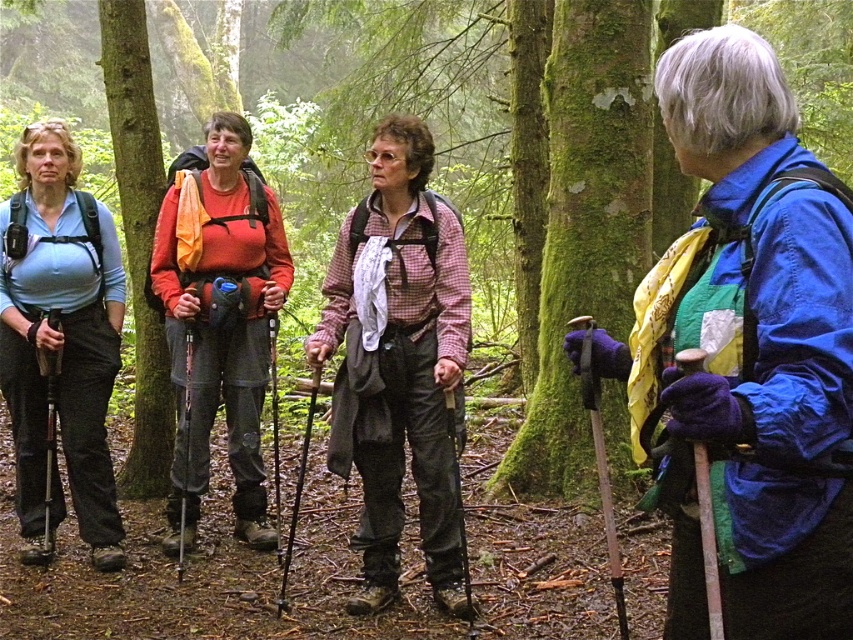
From the picture: Can you confirm if matte blue shirt at left is positioned above green mossy tree at left?

Incorrect, matte blue shirt at left is not positioned above green mossy tree at left.

Which is behind, point (85, 362) or point (154, 470)?

Positioned behind is point (154, 470).

Which is behind, point (28, 266) or point (132, 289)?

Point (132, 289)

The image size is (853, 640). Identify the location of matte blue shirt at left. (61, 340).

Between blue fabric jacket at right and matte orange shirt at center, which one has less height?

blue fabric jacket at right is shorter.

Does blue fabric jacket at right have a greater height compared to matte orange shirt at center?

No, blue fabric jacket at right is not taller than matte orange shirt at center.

The height and width of the screenshot is (640, 853). What do you see at coordinates (747, 352) in the screenshot?
I see `blue fabric jacket at right` at bounding box center [747, 352].

Identify the location of blue fabric jacket at right. Image resolution: width=853 pixels, height=640 pixels. (747, 352).

Is blue fabric jacket at right positioned behind green mossy tree at left?

No, blue fabric jacket at right is in front of green mossy tree at left.

Between blue fabric jacket at right and green mossy tree at left, which one has more height?

green mossy tree at left

Which is behind, point (651, 269) or point (113, 81)?

The point (113, 81) is more distant.

Image resolution: width=853 pixels, height=640 pixels. I want to click on blue fabric jacket at right, so click(x=747, y=352).